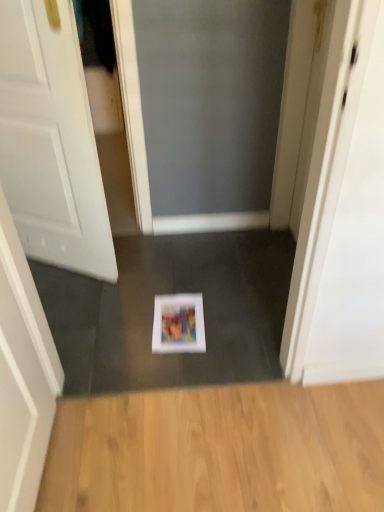
Identify the location of empty space that is ontop of light brown wood flooring at lower center. The height and width of the screenshot is (512, 384). (241, 445).